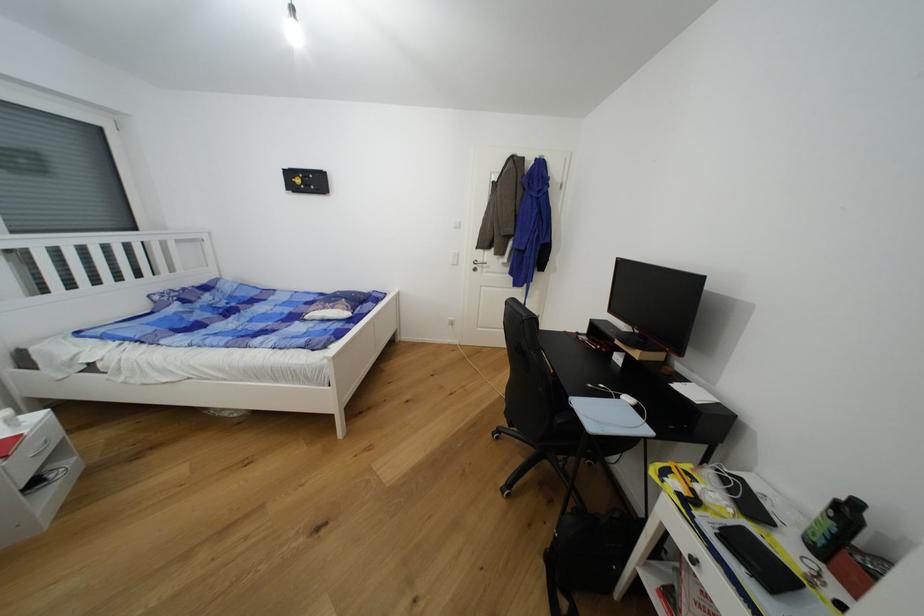
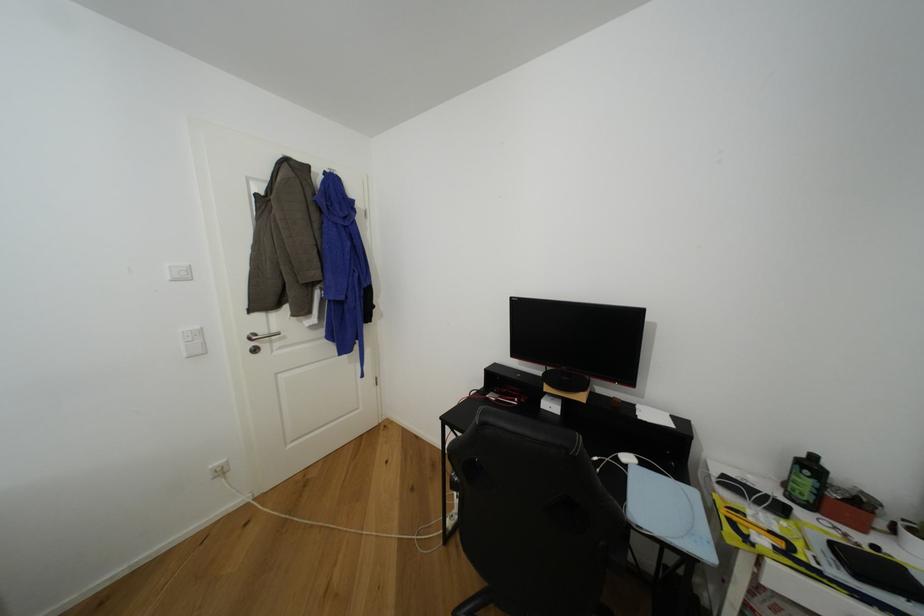
Find the pixel in the second image that matches point (862, 506) in the first image.

(820, 459)